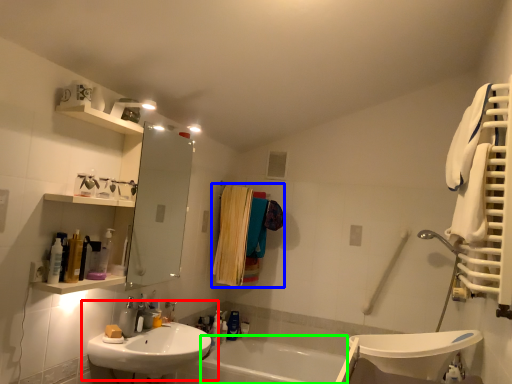
Question: Which object is positioned farthest from sink (highlighted by a red box)? Select from laundry (highlighted by a blue box) and bath (highlighted by a green box).

Choices:
 (A) laundry
 (B) bath

Answer: (B)